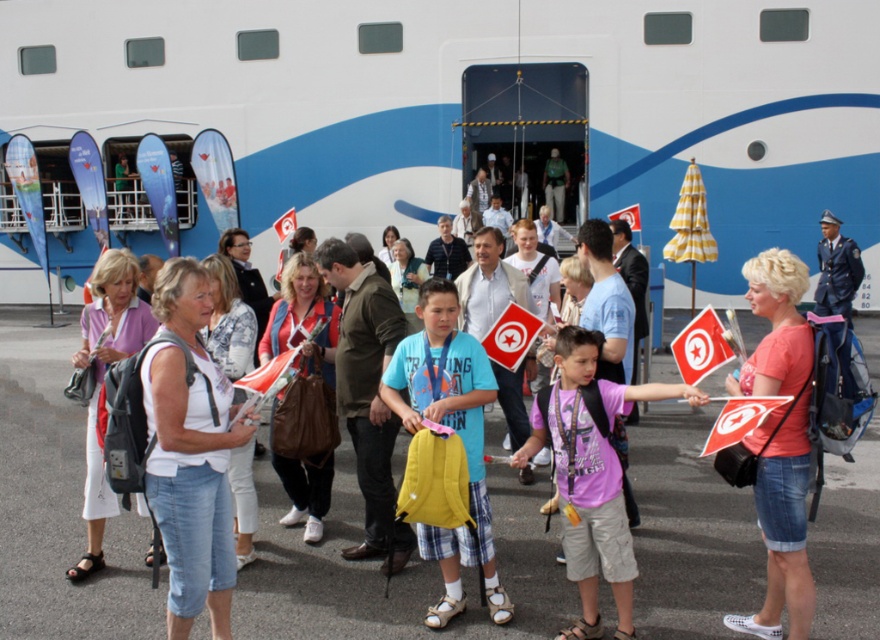
Is point (822, 138) farther from viewer compared to point (446, 547)?

Yes, point (822, 138) is farther from viewer.

You are a GUI agent. You are given a task and a screenshot of the screen. Output one action in this format:
    pyautogui.click(x=<x>, y=<y>)
    Task: Click on the white glossy cruise ship at upper center
    The height and width of the screenshot is (640, 880).
    Given the screenshot: What is the action you would take?
    coord(470,112)

The width and height of the screenshot is (880, 640). In order to click on white glossy cruise ship at upper center in this screenshot , I will do `click(470, 112)`.

Measure the distance between purple cotton shirt at center and yellow fabric backpack at center.

purple cotton shirt at center and yellow fabric backpack at center are 54.14 centimeters apart.

Can you confirm if purple cotton shirt at center is smaller than yellow fabric backpack at center?

Correct, purple cotton shirt at center occupies less space than yellow fabric backpack at center.

Which is in front, point (559, 422) or point (464, 353)?

Positioned in front is point (559, 422).

Locate an element on the screen. purple cotton shirt at center is located at coordinates (585, 486).

Can you confirm if white glossy cruise ship at upper center is wider than purple cotton shirt at center?

Yes, white glossy cruise ship at upper center is wider than purple cotton shirt at center.

Which is behind, point (428, 234) or point (631, 596)?

Positioned behind is point (428, 234).

The height and width of the screenshot is (640, 880). What are the coordinates of `white glossy cruise ship at upper center` in the screenshot? It's located at (470, 112).